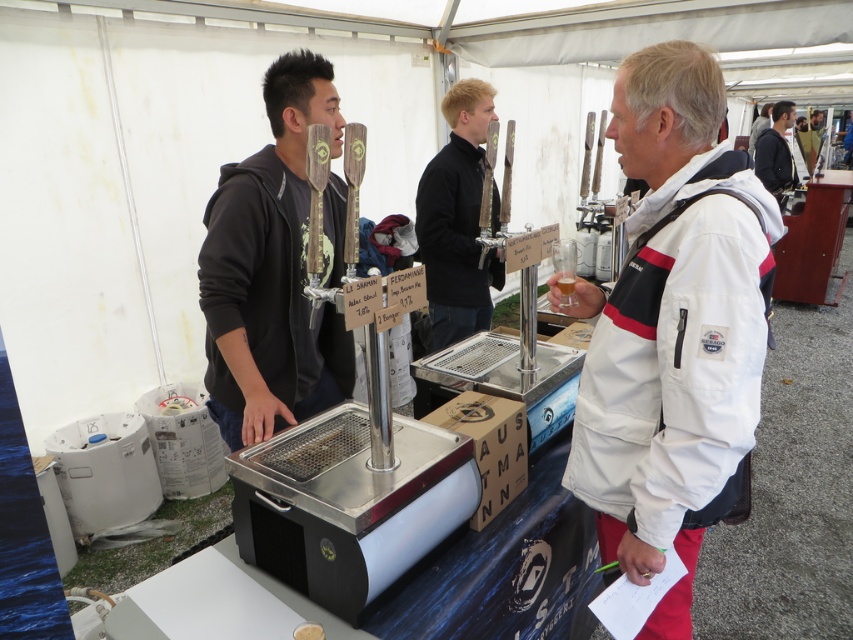
Question: Can you confirm if white softshell jacket at center is positioned to the right of dark gray hoodie at upper center?

Choices:
 (A) yes
 (B) no

Answer: (B)

Question: In this image, where is black hoodie at center located relative to black matte shirt at center?

Choices:
 (A) below
 (B) above

Answer: (A)

Question: Is black matte shirt at center positioned at the back of dark gray hoodie at upper center?

Choices:
 (A) no
 (B) yes

Answer: (A)

Question: Which point is closer to the camera?

Choices:
 (A) (761, 161)
 (B) (221, 211)
 (C) (656, 250)
 (D) (474, 237)

Answer: (C)

Question: Estimate the real-world distances between objects in this image. Which object is farther from the black matte shirt at center?

Choices:
 (A) black hoodie at center
 (B) white softshell jacket at center
 (C) dark gray hoodie at upper center

Answer: (C)

Question: Which of the following is the closest to the observer?

Choices:
 (A) white softshell jacket at center
 (B) dark gray hoodie at upper center
 (C) black hoodie at center

Answer: (A)